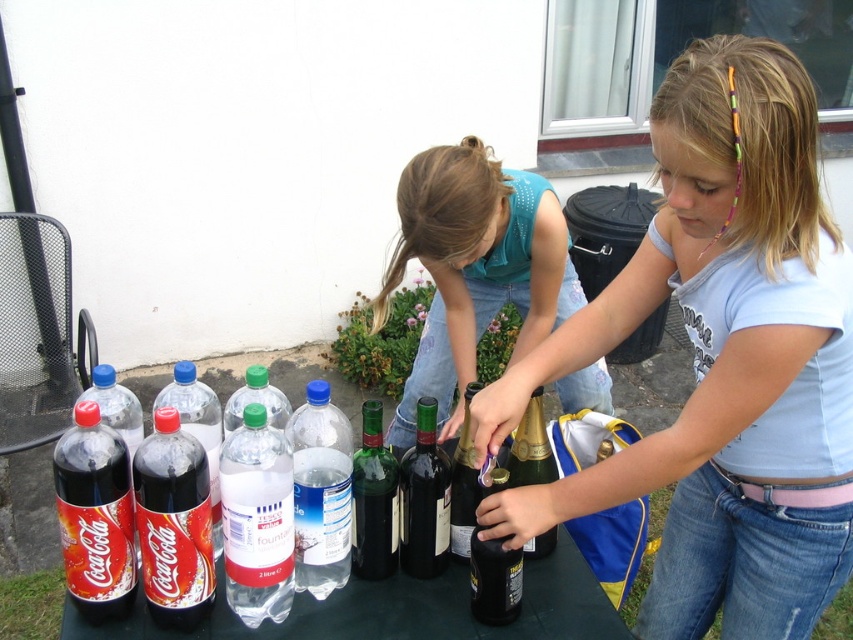
Does teal fabric shirt at center have a smaller size compared to gold foil champagne at center?

No, teal fabric shirt at center is not smaller than gold foil champagne at center.

Which of these two, teal fabric shirt at center or gold foil champagne at center, stands shorter?

gold foil champagne at center

I want to click on teal fabric shirt at center, so click(x=474, y=268).

At what (x,y) coordinates should I click in order to perform the action: click on teal fabric shirt at center. Please return your answer as a coordinate pair (x, y). Image resolution: width=853 pixels, height=640 pixels. Looking at the image, I should click on (474, 268).

Does teal fabric shirt at center have a greater height compared to matte glass coca-cola bottle at lower left?

Yes, teal fabric shirt at center is taller than matte glass coca-cola bottle at lower left.

Is the position of teal fabric shirt at center more distant than that of matte glass coca-cola bottle at lower left?

Yes, teal fabric shirt at center is further from the viewer.

Measure the distance between point (479, 317) and camera.

Point (479, 317) and camera are 2.20 meters apart from each other.

Locate an element on the screen. teal fabric shirt at center is located at coordinates (474, 268).

Between coca-cola glass bottle at lower left and matte black soda bottle at lower left, which one is positioned higher?

matte black soda bottle at lower left

Is coca-cola glass bottle at lower left further to the viewer compared to matte black soda bottle at lower left?

No.

Locate an element on the screen. This screenshot has width=853, height=640. coca-cola glass bottle at lower left is located at coordinates (96, 515).